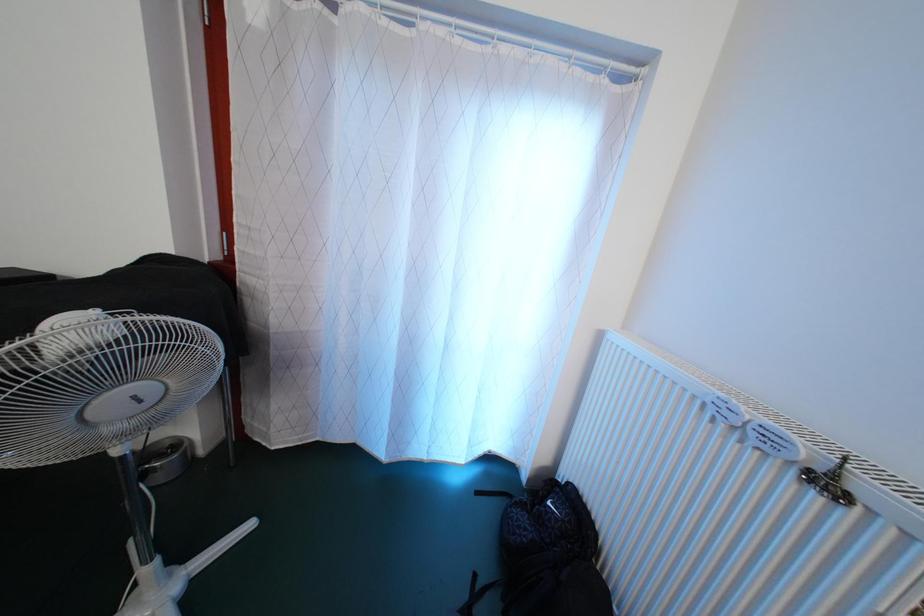
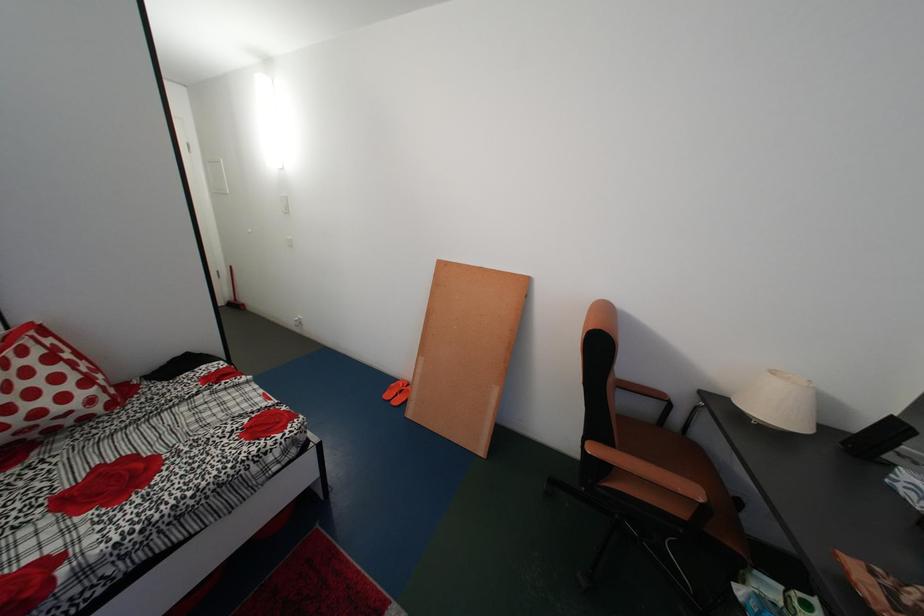
The first image is from the beginning of the video and the second image is from the end. How did the camera likely rotate when shooting the video?

The rotation direction of the camera is left-down.